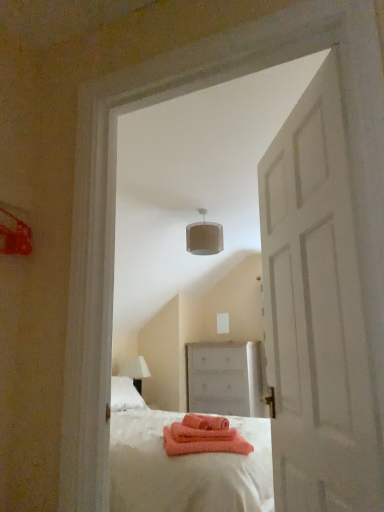
Question: Is the surface of white textured lampshade at upper center in direct contact with white matte door at center?

Choices:
 (A) yes
 (B) no

Answer: (B)

Question: From the image's perspective, is white textured lampshade at upper center beneath white matte door at center?

Choices:
 (A) no
 (B) yes

Answer: (A)

Question: Is white textured lampshade at upper center not within white matte door at center?

Choices:
 (A) yes
 (B) no

Answer: (A)

Question: Considering the relative sizes of white textured lampshade at upper center and white matte door at center in the image provided, is white textured lampshade at upper center smaller than white matte door at center?

Choices:
 (A) no
 (B) yes

Answer: (B)

Question: Can you confirm if white textured lampshade at upper center is wider than white matte door at center?

Choices:
 (A) yes
 (B) no

Answer: (A)

Question: Looking at their shapes, would you say white matte door at center is wider or thinner than white matte chest of drawers at center?

Choices:
 (A) thin
 (B) wide

Answer: (A)

Question: From a real-world perspective, is white matte door at center positioned above or below white matte chest of drawers at center?

Choices:
 (A) below
 (B) above

Answer: (B)

Question: Considering the positions of white matte door at center and white matte chest of drawers at center in the image, is white matte door at center bigger or smaller than white matte chest of drawers at center?

Choices:
 (A) big
 (B) small

Answer: (B)

Question: From the image's perspective, is white matte door at center located above or below white matte chest of drawers at center?

Choices:
 (A) above
 (B) below

Answer: (A)

Question: Relative to white textured lampshade at upper center, is white matte door at center in front or behind?

Choices:
 (A) behind
 (B) front

Answer: (B)

Question: Is white matte door at center taller or shorter than white textured lampshade at upper center?

Choices:
 (A) tall
 (B) short

Answer: (A)

Question: In terms of width, does white matte door at center look wider or thinner when compared to white textured lampshade at upper center?

Choices:
 (A) wide
 (B) thin

Answer: (B)

Question: In terms of size, does white matte door at center appear bigger or smaller than white textured lampshade at upper center?

Choices:
 (A) big
 (B) small

Answer: (A)

Question: From the image's perspective, is white matte chest of drawers at center located above or below white textured lampshade at upper center?

Choices:
 (A) below
 (B) above

Answer: (A)

Question: Is white matte chest of drawers at center wider or thinner than white textured lampshade at upper center?

Choices:
 (A) thin
 (B) wide

Answer: (B)